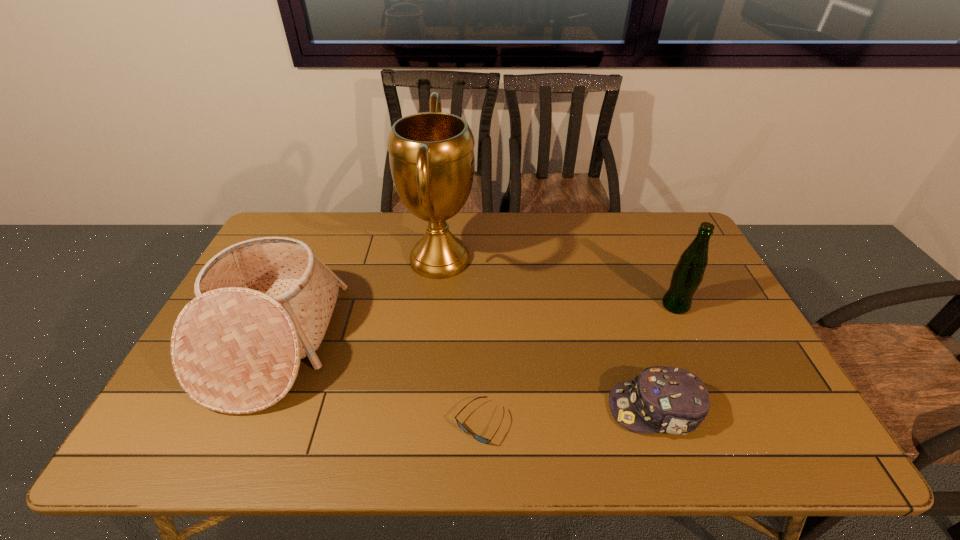
Identify the location of vacant space located on the front-facing side of the fourth tallest object. The height and width of the screenshot is (540, 960). (494, 409).

Find the location of a particular element. free spot located on the front-facing side of the fourth tallest object is located at coordinates click(524, 409).

At what (x,y) coordinates should I click in order to perform the action: click on blank space located on the front-facing side of the fourth tallest object. Please return your answer as a coordinate pair (x, y). Looking at the image, I should click on (528, 409).

The image size is (960, 540). Identify the location of object that is at the far edge. (431, 155).

Identify the location of headwear located in the near edge section of the desktop. This screenshot has width=960, height=540. (669, 400).

Where is `sunglasses present at the near edge`? This screenshot has height=540, width=960. sunglasses present at the near edge is located at coordinates (481, 439).

The width and height of the screenshot is (960, 540). Identify the location of object at the left edge. (263, 304).

You are a GUI agent. You are given a task and a screenshot of the screen. Output one action in this format:
    pyautogui.click(x=<x>, y=<y>)
    Task: Click on the object present at the right edge
    This screenshot has width=960, height=540.
    Given the screenshot: What is the action you would take?
    pyautogui.click(x=688, y=273)

You are a GUI agent. You are given a task and a screenshot of the screen. Output one action in this format:
    pyautogui.click(x=<x>, y=<y>)
    Task: Click on the vacant space at the far edge of the desktop
    The height and width of the screenshot is (540, 960).
    Given the screenshot: What is the action you would take?
    pyautogui.click(x=473, y=226)

You are a GUI agent. You are given a task and a screenshot of the screen. Output one action in this format:
    pyautogui.click(x=<x>, y=<y>)
    Task: Click on the vacant space at the near edge
    
    Given the screenshot: What is the action you would take?
    pyautogui.click(x=251, y=454)